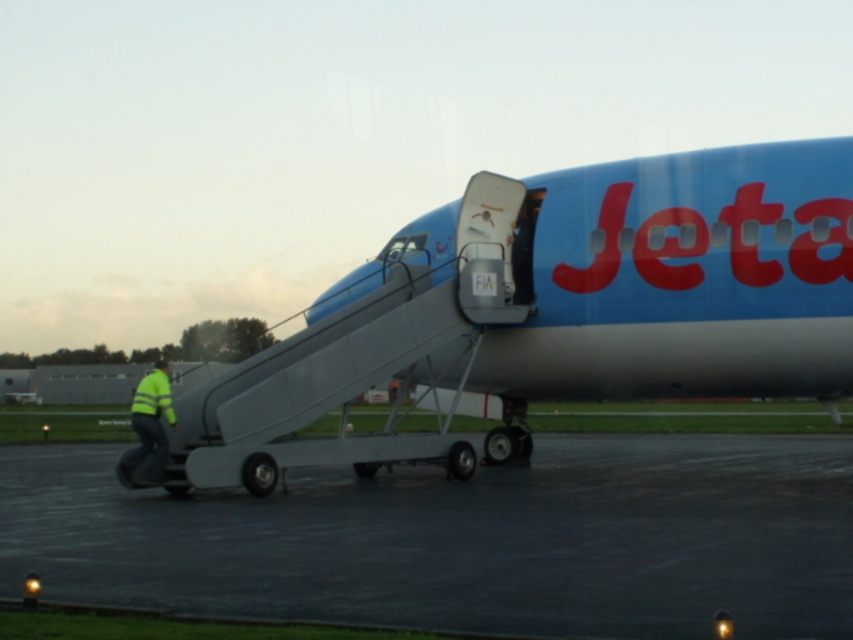
Is black asphalt tarmac at lower center thinner than yellow reflective jacket at lower left?

No, black asphalt tarmac at lower center is not thinner than yellow reflective jacket at lower left.

Consider the image. Can you confirm if black asphalt tarmac at lower center is bigger than yellow reflective jacket at lower left?

Correct, black asphalt tarmac at lower center is larger in size than yellow reflective jacket at lower left.

In order to click on black asphalt tarmac at lower center in this screenshot , I will do `click(466, 540)`.

Where is `black asphalt tarmac at lower center`? black asphalt tarmac at lower center is located at coordinates (466, 540).

Is blue matte airplane at center taller than black asphalt tarmac at lower center?

No, blue matte airplane at center is not taller than black asphalt tarmac at lower center.

Who is shorter, blue matte airplane at center or black asphalt tarmac at lower center?

With less height is blue matte airplane at center.

At what (x,y) coordinates should I click in order to perform the action: click on blue matte airplane at center. Please return your answer as a coordinate pair (x, y). The width and height of the screenshot is (853, 640). Looking at the image, I should click on (558, 308).

Does blue matte airplane at center have a lesser height compared to yellow reflective jacket at lower left?

Correct, blue matte airplane at center is not as tall as yellow reflective jacket at lower left.

Between blue matte airplane at center and yellow reflective jacket at lower left, which one has more height?

Standing taller between the two is yellow reflective jacket at lower left.

From the picture: Who is more distant from viewer, (718,230) or (131,484)?

Point (718,230)

Where is `blue matte airplane at center`? The image size is (853, 640). blue matte airplane at center is located at coordinates (558, 308).